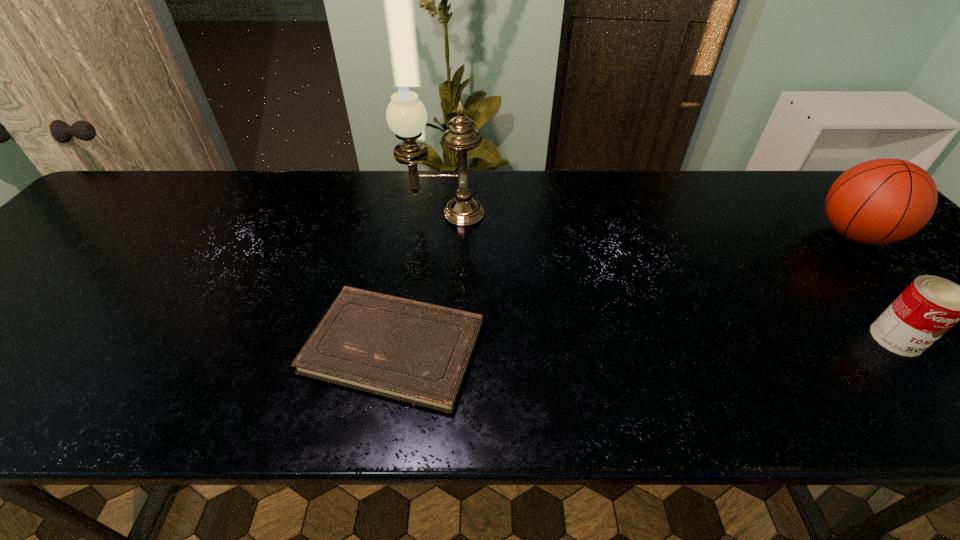
The height and width of the screenshot is (540, 960). I want to click on oil lamp, so click(406, 115).

Where is `basketball`? The width and height of the screenshot is (960, 540). basketball is located at coordinates (880, 201).

The width and height of the screenshot is (960, 540). In order to click on the third tallest object in this screenshot , I will do `click(930, 305)`.

In order to click on paperback book in this screenshot , I will do `click(416, 352)`.

You are a GUI agent. You are given a task and a screenshot of the screen. Output one action in this format:
    pyautogui.click(x=<x>, y=<y>)
    Task: Click on the vacant position located on the left of the oil lamp
    This screenshot has width=960, height=540.
    Given the screenshot: What is the action you would take?
    pyautogui.click(x=383, y=214)

This screenshot has height=540, width=960. What are the coordinates of `vacant space situated 0.050m on the front of the third shortest object` in the screenshot? It's located at (892, 276).

Find the location of `blank space located 0.050m on the front label of the can`. blank space located 0.050m on the front label of the can is located at coordinates (929, 379).

Identify the location of vacant space situated 0.350m on the left of the shortest object. This screenshot has height=540, width=960. (133, 347).

The image size is (960, 540). I want to click on oil lamp that is at the far edge, so click(406, 115).

The height and width of the screenshot is (540, 960). In order to click on basketball present at the far edge in this screenshot , I will do `click(880, 201)`.